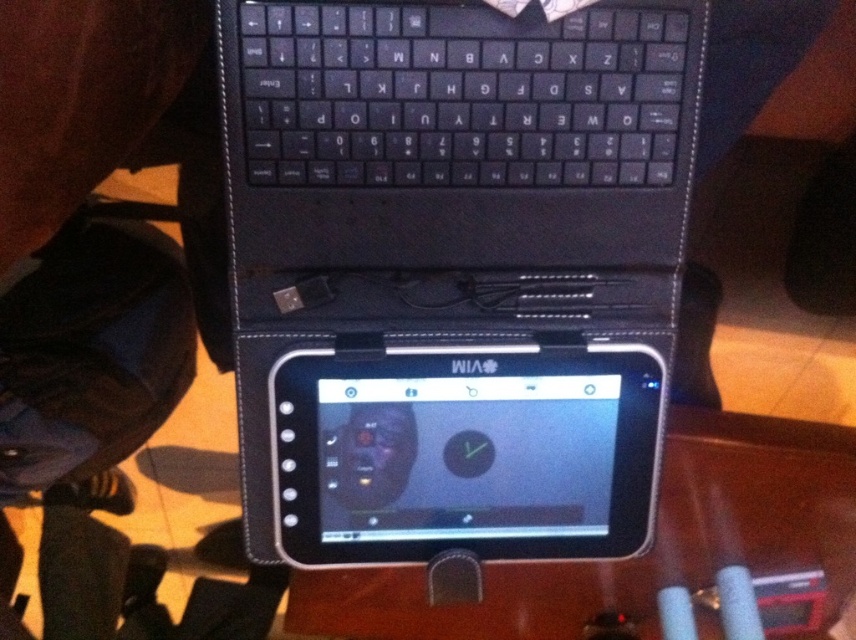
Question: Is black matte tablet at center wider than black plastic keyboard at upper center?

Choices:
 (A) yes
 (B) no

Answer: (A)

Question: Which of the following is the farthest from the observer?

Choices:
 (A) (562, 81)
 (B) (296, 362)
 (C) (581, 44)

Answer: (B)

Question: Which point appears closest to the camera in this image?

Choices:
 (A) (522, 524)
 (B) (593, 58)
 (C) (366, 483)

Answer: (B)

Question: Which object is the closest to the black glossy tablet at center?

Choices:
 (A) black plastic keyboard at upper center
 (B) black matte tablet at center

Answer: (B)

Question: In this image, where is black matte tablet at center located relative to black glossy tablet at center?

Choices:
 (A) left
 (B) right

Answer: (A)

Question: Does black matte tablet at center lie in front of black glossy tablet at center?

Choices:
 (A) no
 (B) yes

Answer: (B)